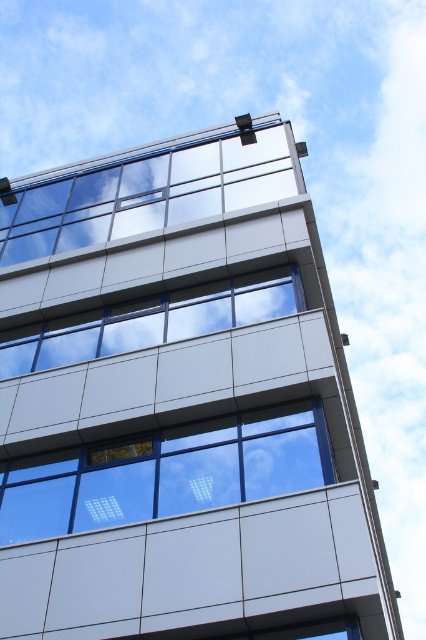
You are standing in front of the modern multi story building and want to locate the clear glass window at center and the transparent glass window at upper center. According to the scene, which one is positioned to the left?

The clear glass window at center is positioned to the left of the transparent glass window at upper center.

You are an architect evaluating the building facade. You need to install a new security film on the transparent glass window at upper center and the white glossy window at center. Which window requires a larger security film?

The transparent glass window at upper center requires a larger security film because it has a larger size compared to the white glossy window at center.

You are an architect reviewing the building design. You notice two windows, the clear glass window at center and the transparent glass window at upper center. Which window is located above the other?

The transparent glass window at upper center is located above the clear glass window at center.